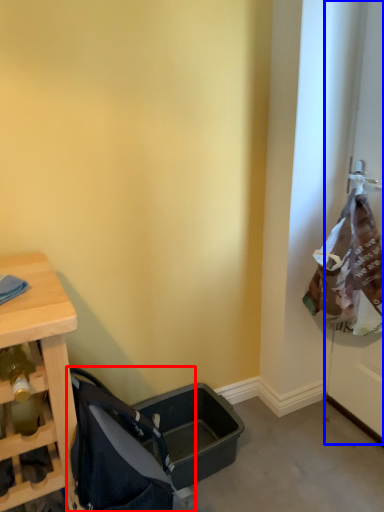
Question: Among these objects, which one is farthest to the camera, baby carriage (highlighted by a red box) or screen door (highlighted by a blue box)?

Choices:
 (A) baby carriage
 (B) screen door

Answer: (B)